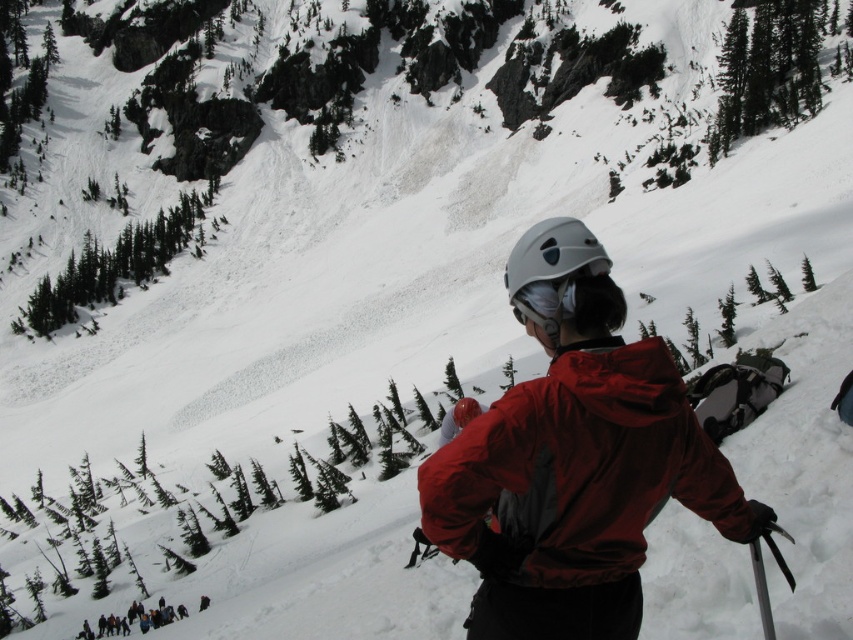
Question: Which point appears closest to the camera in this image?

Choices:
 (A) (706, 499)
 (B) (544, 227)

Answer: (B)

Question: Can you confirm if red matte jacket at center is bigger than white matte helmet at center?

Choices:
 (A) no
 (B) yes

Answer: (B)

Question: Which point is closer to the camera?

Choices:
 (A) white matte helmet at center
 (B) red matte jacket at center

Answer: (B)

Question: Can you confirm if red matte jacket at center is thinner than white matte helmet at center?

Choices:
 (A) no
 (B) yes

Answer: (A)

Question: Does red matte jacket at center lie in front of white matte helmet at center?

Choices:
 (A) no
 (B) yes

Answer: (B)